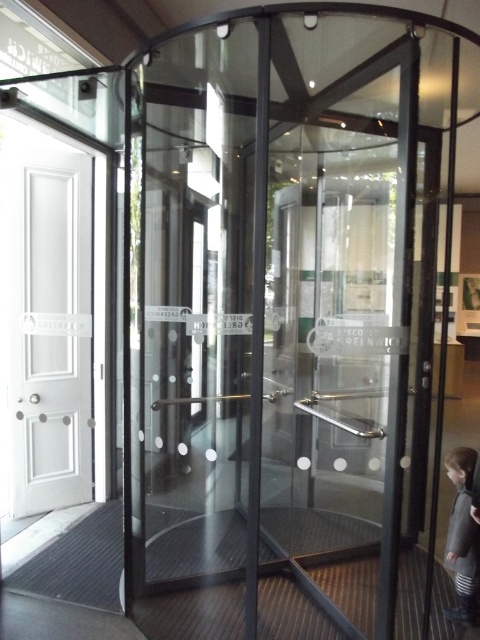
Can you confirm if white matte door at left is thinner than dark gray coat at lower right?

Incorrect, white matte door at left's width is not less than dark gray coat at lower right's.

Which is behind, point (75, 492) or point (454, 536)?

Point (75, 492)

Who is more distant from viewer, (25, 403) or (465, 624)?

The point (25, 403) is more distant.

Image resolution: width=480 pixels, height=640 pixels. I want to click on white matte door at left, so click(45, 321).

Does transparent glass door at center have a greater width compared to dark gray coat at lower right?

Correct, the width of transparent glass door at center exceeds that of dark gray coat at lower right.

Between transparent glass door at center and dark gray coat at lower right, which one appears on the right side from the viewer's perspective?

dark gray coat at lower right

Measure the distance between transparent glass door at center and camera.

transparent glass door at center and camera are 1.84 meters apart.

The height and width of the screenshot is (640, 480). I want to click on transparent glass door at center, so click(x=272, y=328).

Is transparent glass door at center smaller than white matte door at left?

No, transparent glass door at center is not smaller than white matte door at left.

Can you confirm if transparent glass door at center is positioned to the left of white matte door at left?

In fact, transparent glass door at center is to the right of white matte door at left.

Between point (393, 150) and point (43, 237), which one is positioned behind?

Positioned behind is point (43, 237).

The width and height of the screenshot is (480, 640). I want to click on transparent glass door at center, so click(272, 328).